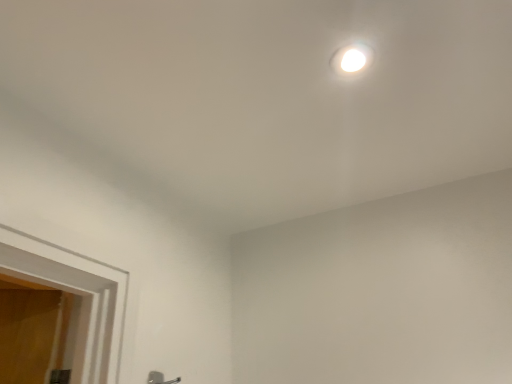
Question: Is white glossy droplight at upper center inside satin nickel door handle at lower center?

Choices:
 (A) yes
 (B) no

Answer: (B)

Question: Is satin nickel door handle at lower center positioned before white glossy droplight at upper center?

Choices:
 (A) yes
 (B) no

Answer: (B)

Question: Is satin nickel door handle at lower center shorter than white glossy droplight at upper center?

Choices:
 (A) no
 (B) yes

Answer: (A)

Question: Can you confirm if satin nickel door handle at lower center is positioned to the left of white glossy droplight at upper center?

Choices:
 (A) no
 (B) yes

Answer: (B)

Question: From the image's perspective, does satin nickel door handle at lower center appear lower than white glossy droplight at upper center?

Choices:
 (A) yes
 (B) no

Answer: (A)

Question: Considering the relative sizes of satin nickel door handle at lower center and white glossy droplight at upper center in the image provided, is satin nickel door handle at lower center bigger than white glossy droplight at upper center?

Choices:
 (A) no
 (B) yes

Answer: (B)

Question: Considering the relative positions of white glossy droplight at upper center and satin nickel door handle at lower center in the image provided, is white glossy droplight at upper center to the right of satin nickel door handle at lower center from the viewer's perspective?

Choices:
 (A) no
 (B) yes

Answer: (B)

Question: Can you confirm if white glossy droplight at upper center is thinner than satin nickel door handle at lower center?

Choices:
 (A) no
 (B) yes

Answer: (A)

Question: Is white glossy droplight at upper center turned away from satin nickel door handle at lower center?

Choices:
 (A) no
 (B) yes

Answer: (A)

Question: Considering the relative sizes of white glossy droplight at upper center and satin nickel door handle at lower center in the image provided, is white glossy droplight at upper center bigger than satin nickel door handle at lower center?

Choices:
 (A) yes
 (B) no

Answer: (B)

Question: Considering the relative positions of white glossy droplight at upper center and satin nickel door handle at lower center in the image provided, is white glossy droplight at upper center behind satin nickel door handle at lower center?

Choices:
 (A) yes
 (B) no

Answer: (B)

Question: From a real-world perspective, is white glossy droplight at upper center physically above satin nickel door handle at lower center?

Choices:
 (A) yes
 (B) no

Answer: (A)

Question: Is satin nickel door handle at lower center wider or thinner than white glossy droplight at upper center?

Choices:
 (A) thin
 (B) wide

Answer: (A)